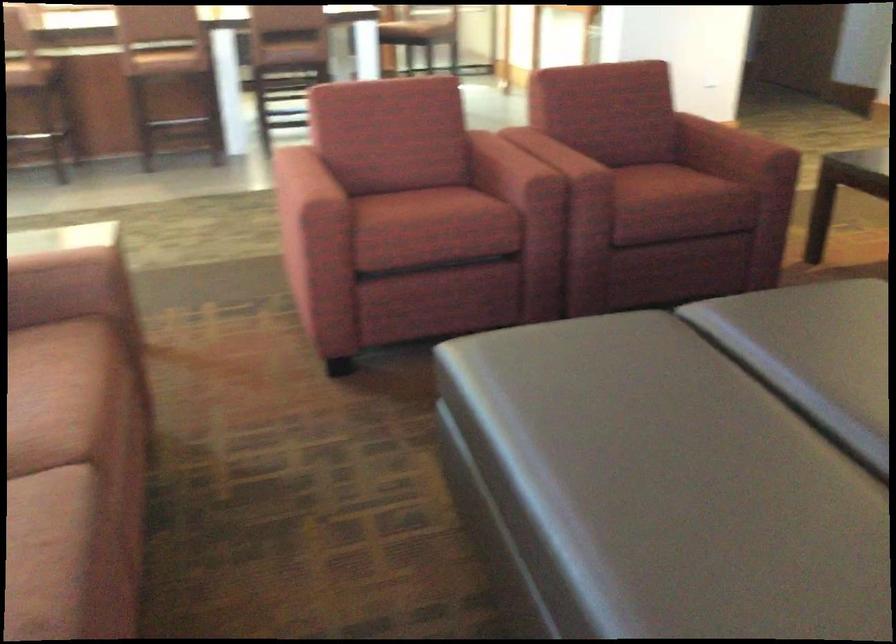
Question: The images are taken continuously from a first-person perspective. In which direction is your viewpoint rotating?

Choices:
 (A) Left
 (B) Right
 (C) Up
 (D) Down

Answer: (B)